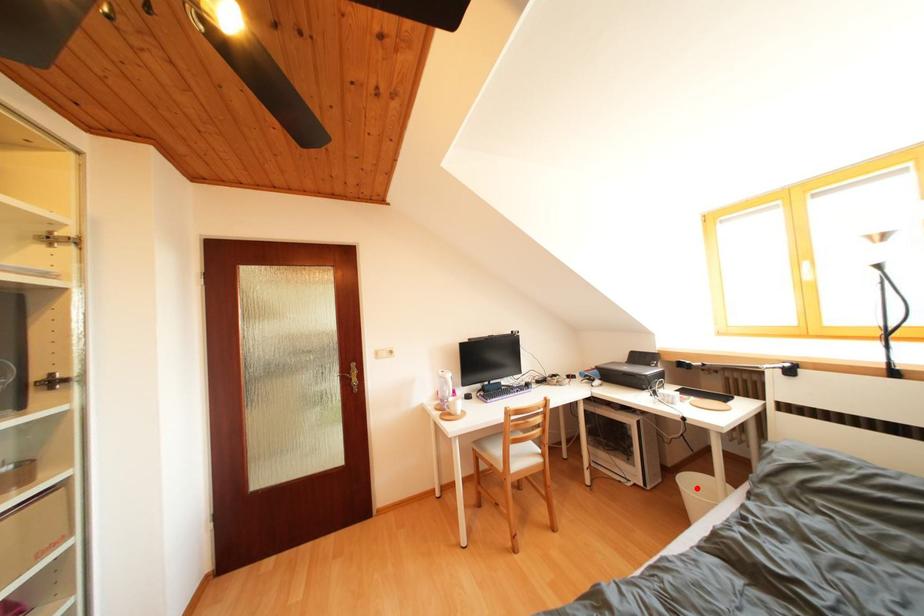
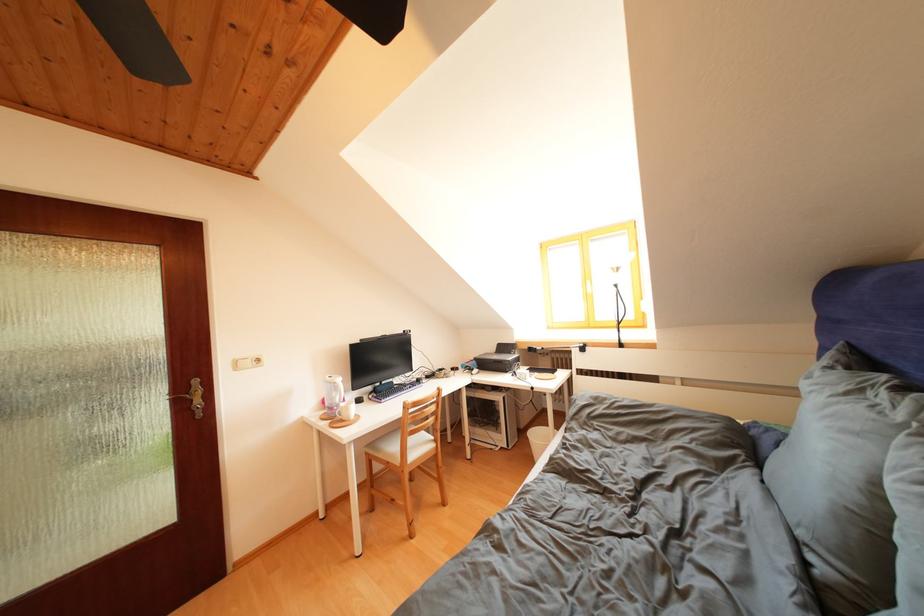
In the second image, find the point that corresponds to the highlighted location in the first image.

(542, 439)